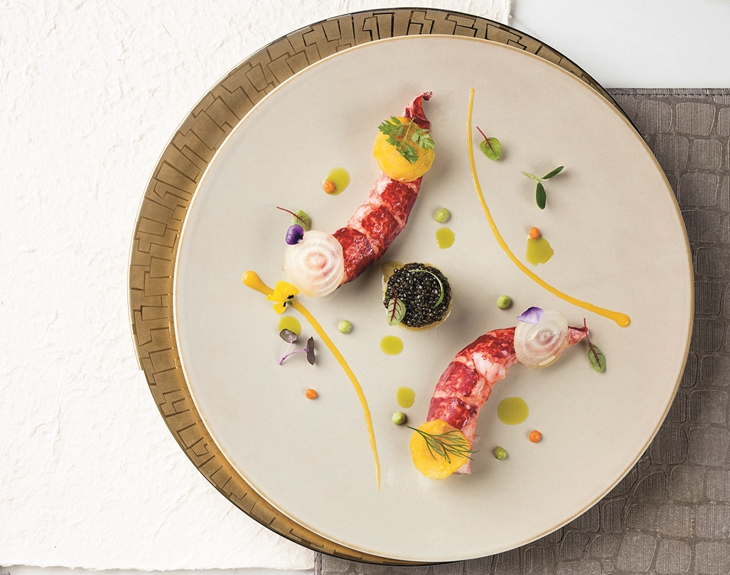
Locate an element on the screen. table mat is located at coordinates (695, 128).